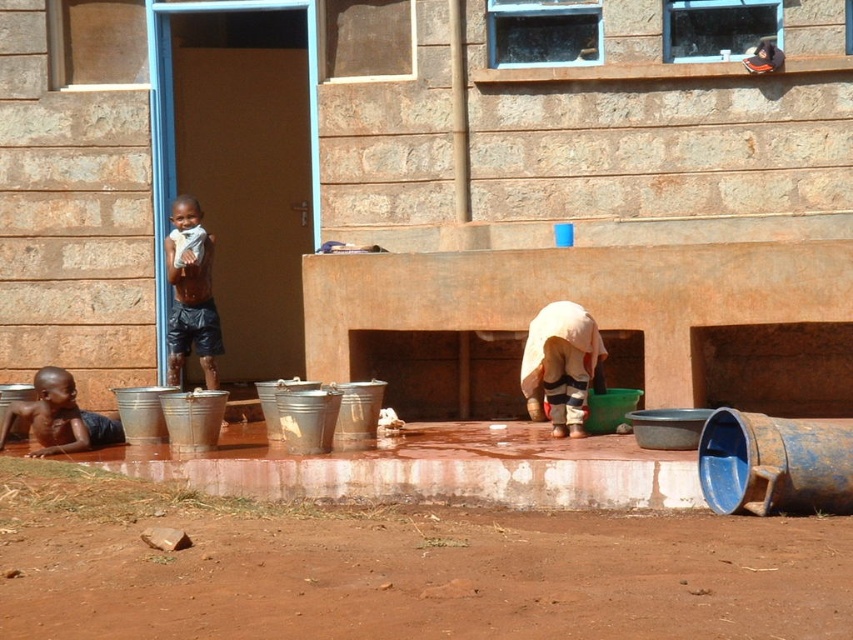
Question: Does dark brown shorts at left appear under dark blue fabric at lower left?

Choices:
 (A) no
 (B) yes

Answer: (A)

Question: Considering the real-world distances, which object is farthest from the dark brown shorts at left?

Choices:
 (A) dark blue fabric at lower left
 (B) blue rusty barrel at lower right
 (C) brown dirt field at lower center

Answer: (B)

Question: Which object is positioned farthest from the brown stone wall at center?

Choices:
 (A) light beige fabric at lower center
 (B) dark blue fabric at lower left
 (C) blue rusty barrel at lower right

Answer: (C)

Question: Does light beige fabric at lower center have a larger size compared to dark brown shorts at left?

Choices:
 (A) no
 (B) yes

Answer: (A)

Question: Estimate the real-world distances between objects in this image. Which object is farther from the blue rusty barrel at lower right?

Choices:
 (A) brown stone wall at center
 (B) dark blue fabric at lower left
 (C) dark brown shorts at left

Answer: (C)

Question: Does brown stone wall at center appear under light beige fabric at lower center?

Choices:
 (A) no
 (B) yes

Answer: (A)